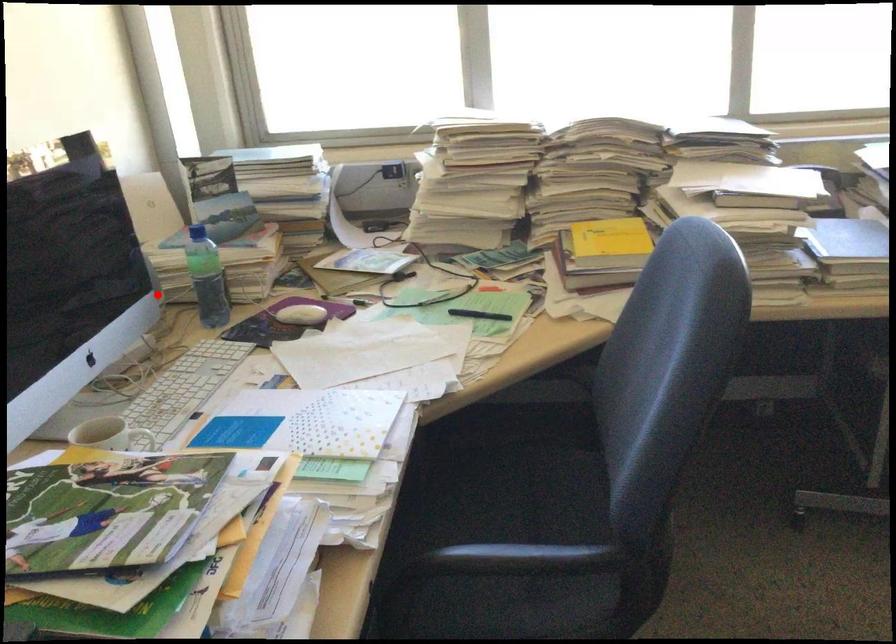
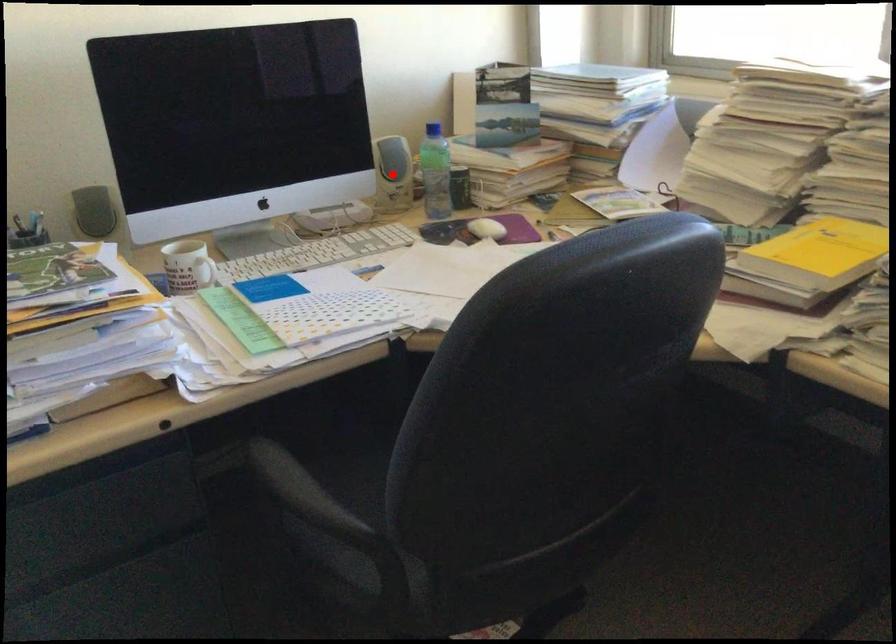
I am providing you with two images of the same scene from different viewpoints. A red point is marked on the first image and another point is marked on the second image. Is the red point in image1 aligned with the point shown in image2?

Yes